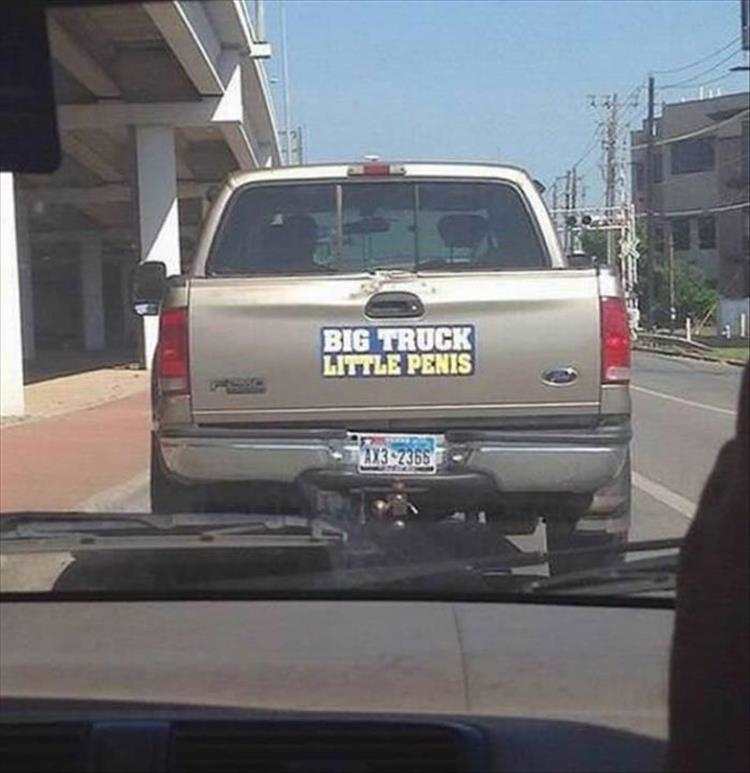
Locate an element on the screen. This screenshot has height=773, width=750. sticker is located at coordinates (410, 352).